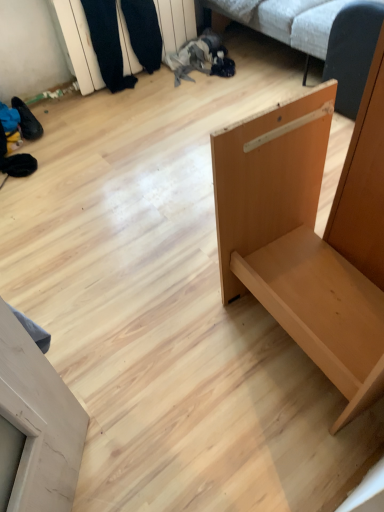
Identify the location of free region on the left part of light brown wood shelf at right, which is the 2th furniture from left to right. Image resolution: width=384 pixels, height=512 pixels. (176, 345).